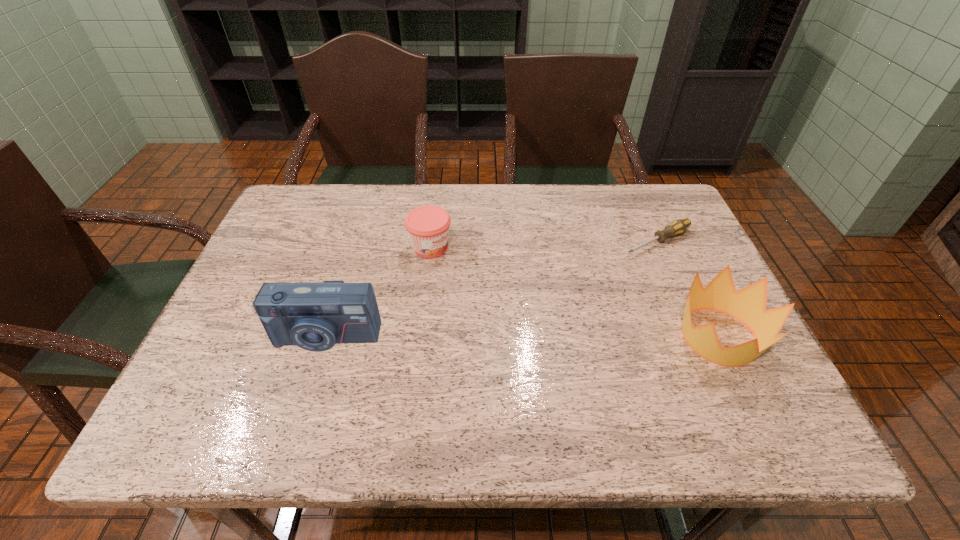
Where is `vacant point that satisfies the following two spatial constraints: 1. on the back side of the screwdriver; 2. on the left side of the jam`? vacant point that satisfies the following two spatial constraints: 1. on the back side of the screwdriver; 2. on the left side of the jam is located at coordinates (431, 241).

Find the location of a particular element. The height and width of the screenshot is (540, 960). free region that satisfies the following two spatial constraints: 1. on the lens of the crown; 2. on the left side of the camera is located at coordinates (325, 337).